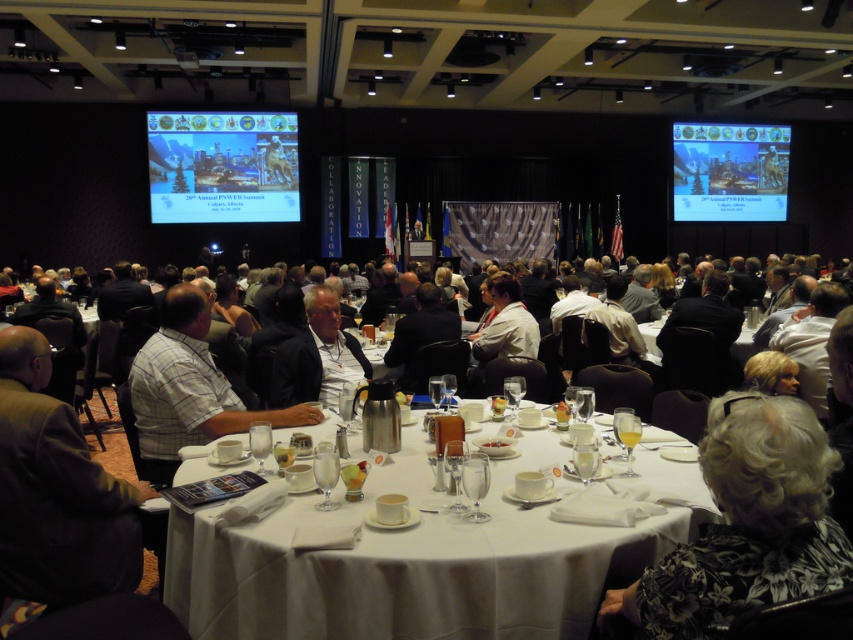
Question: Where is light brown leather jacket at center located in relation to dark brown leather jacket at center in the image?

Choices:
 (A) above
 (B) below

Answer: (B)

Question: Which is farther from the plaid shirt at center?

Choices:
 (A) gray floral dress at lower right
 (B) white plastic table at center

Answer: (B)

Question: Is gray floral dress at lower right positioned behind dark brown leather jacket at center?

Choices:
 (A) no
 (B) yes

Answer: (A)

Question: Which of these objects is positioned farthest from the dark brown leather jacket at center?

Choices:
 (A) gray floral dress at lower right
 (B) matte plastic projector screen at upper right

Answer: (B)

Question: Does gray plaid shirt at center have a smaller size compared to plaid shirt at center?

Choices:
 (A) no
 (B) yes

Answer: (B)

Question: Which object is positioned farthest from the light brown leather jacket at center?

Choices:
 (A) dark brown leather jacket at center
 (B) white cloth-covered table at center
 (C) matte plastic projector screen at upper right

Answer: (C)